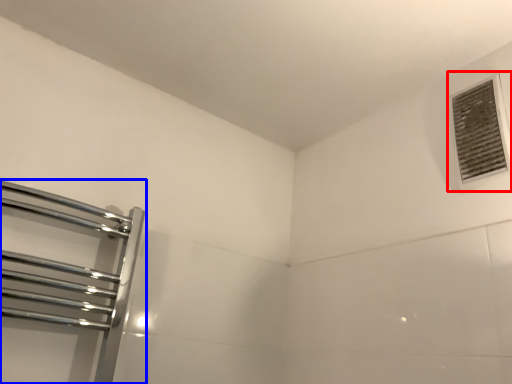
Question: Which object appears closest to the camera in this image, air conditioning (highlighted by a red box) or towel rack (highlighted by a blue box)?

Choices:
 (A) air conditioning
 (B) towel rack

Answer: (B)